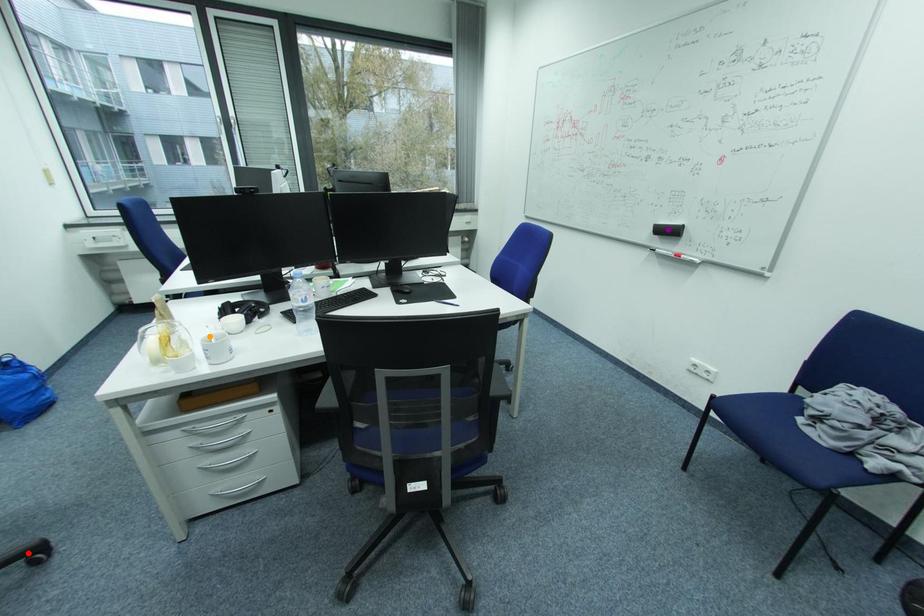
Order these from nearest to farthest:
1. purple point
2. orange point
3. red point

1. red point
2. orange point
3. purple point